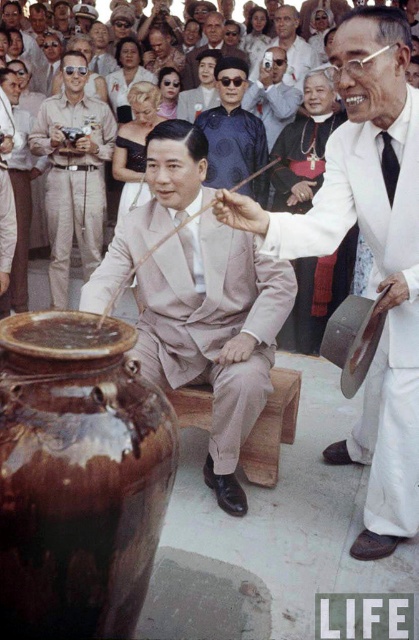
Question: Which point is farther to the camera?

Choices:
 (A) matte beige suit at center
 (B) khaki cotton uniform at left
 (C) brown glazed vase at lower left
 (D) blue silk robe at center

Answer: (B)

Question: Can you confirm if matte beige suit at center is positioned to the left of blue silk robe at center?

Choices:
 (A) yes
 (B) no

Answer: (A)

Question: Can you confirm if dark blue suit at center is positioned above smooth skin face at center?

Choices:
 (A) no
 (B) yes

Answer: (A)

Question: Which object appears closest to the camera in this image?

Choices:
 (A) brown glazed vase at lower left
 (B) blue silk robe at center

Answer: (A)

Question: Which object is the farthest from the dark blue suit at center?

Choices:
 (A) white matte suit at center
 (B) smooth skin face at center

Answer: (A)

Question: Considering the relative positions of brown glazed vase at lower left and khaki cotton uniform at left in the image provided, where is brown glazed vase at lower left located with respect to khaki cotton uniform at left?

Choices:
 (A) left
 (B) right

Answer: (B)